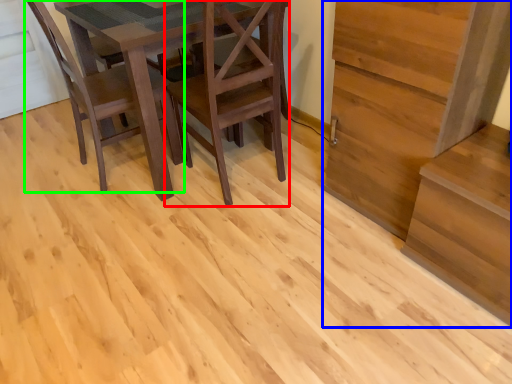
Question: Which object is the farthest from chair (highlighted by a red box)? Choose among these: stairwell (highlighted by a blue box) or chair (highlighted by a green box).

Choices:
 (A) stairwell
 (B) chair

Answer: (A)